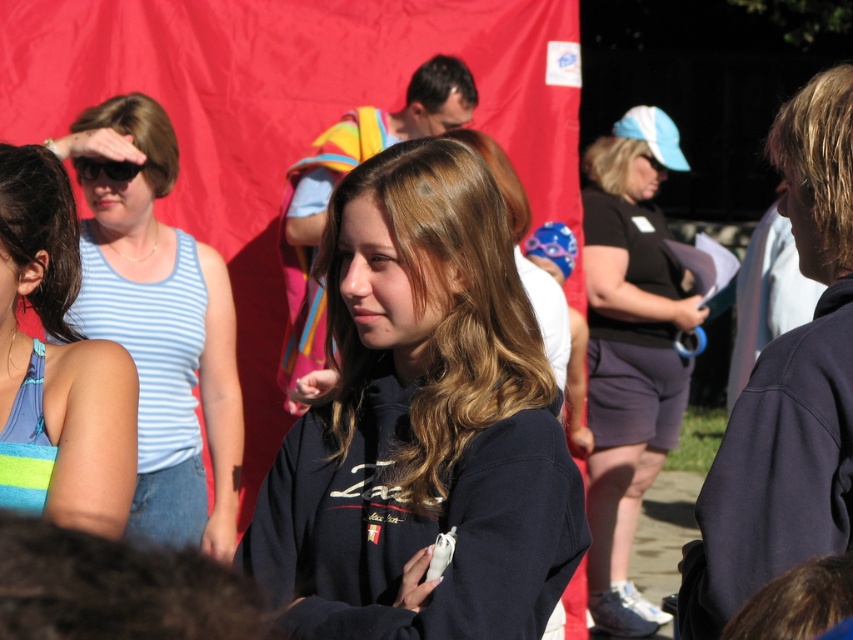
Question: Based on their relative distances, which object is farther from the dark brown hair at left?

Choices:
 (A) blue striped tank top at left
 (B) black t-shirt at center
 (C) brownsmoothhair at center
 (D) black plastic sunglasses at upper left

Answer: (B)

Question: Is dark brown silky hair at lower left bigger than dark brown hair at upper center?

Choices:
 (A) no
 (B) yes

Answer: (A)

Question: Among these points, which one is farthest from the camera?

Choices:
 (A) (808, 166)
 (B) (111, 177)
 (C) (463, 131)
 (D) (780, 608)

Answer: (C)

Question: Which point is closer to the camera taking this photo?

Choices:
 (A) [836, 132]
 (B) [491, 148]
 (C) [811, 588]

Answer: (C)

Question: Can you confirm if black t-shirt at center is positioned below blue striped tank top at left?

Choices:
 (A) no
 (B) yes

Answer: (A)

Question: Can you confirm if blondehair at right is bigger than brown smooth hair at center?

Choices:
 (A) no
 (B) yes

Answer: (A)